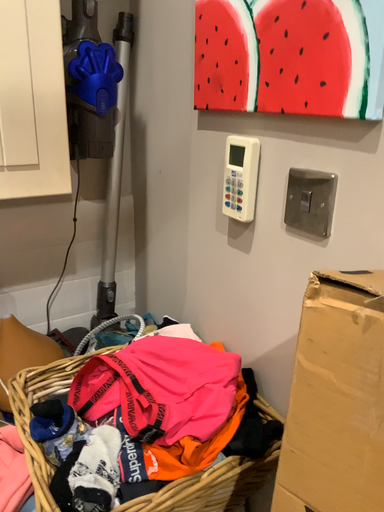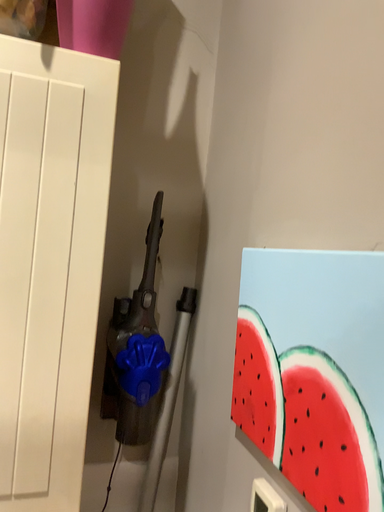
Question: How did the camera likely rotate when shooting the video?

Choices:
 (A) rotated downward
 (B) rotated upward

Answer: (B)